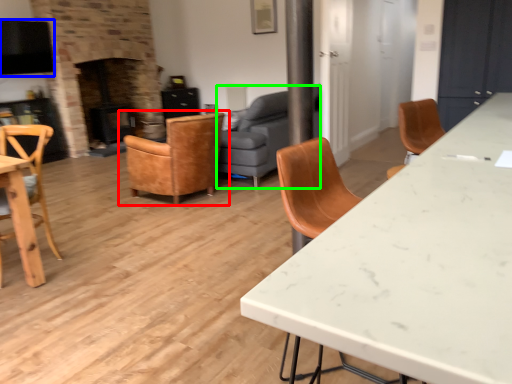
Question: Estimate the real-world distances between objects in this image. Which object is farther from chair (highlighted by a red box), exhaust hood (highlighted by a blue box) or studio couch (highlighted by a green box)?

Choices:
 (A) exhaust hood
 (B) studio couch

Answer: (A)